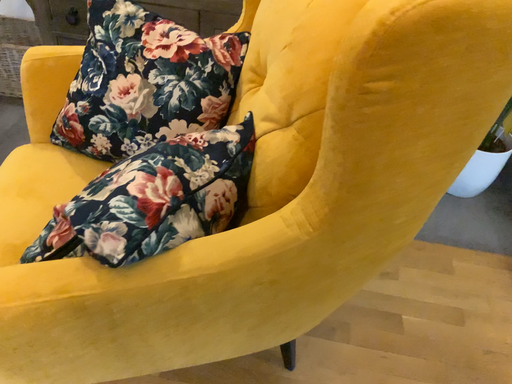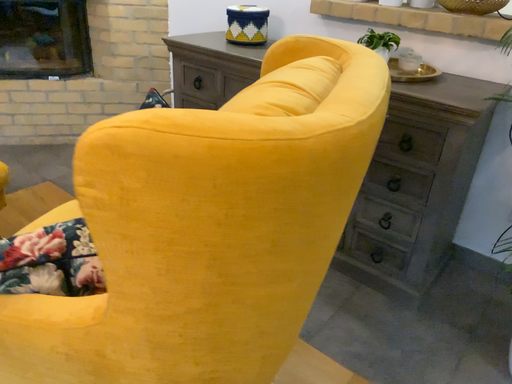
Question: How did the camera likely rotate when shooting the video?

Choices:
 (A) rotated right
 (B) rotated left

Answer: (B)